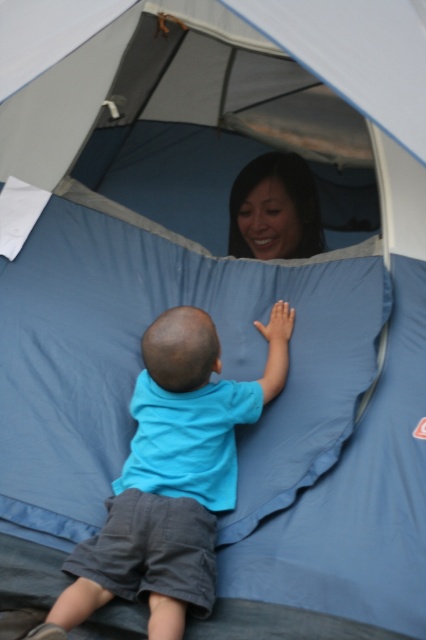
Question: Is blue cotton shirt at center thinner than smooth skin face at upper center?

Choices:
 (A) no
 (B) yes

Answer: (A)

Question: Does blue cotton shirt at center appear over smooth skin face at upper center?

Choices:
 (A) yes
 (B) no

Answer: (B)

Question: Which of the following is the closest to the observer?

Choices:
 (A) click(62, 605)
 (B) click(262, 188)

Answer: (A)

Question: Which point is closer to the camera taking this photo?

Choices:
 (A) (252, 172)
 (B) (149, 378)

Answer: (B)

Question: Is blue cotton shirt at center smaller than smooth skin face at upper center?

Choices:
 (A) no
 (B) yes

Answer: (A)